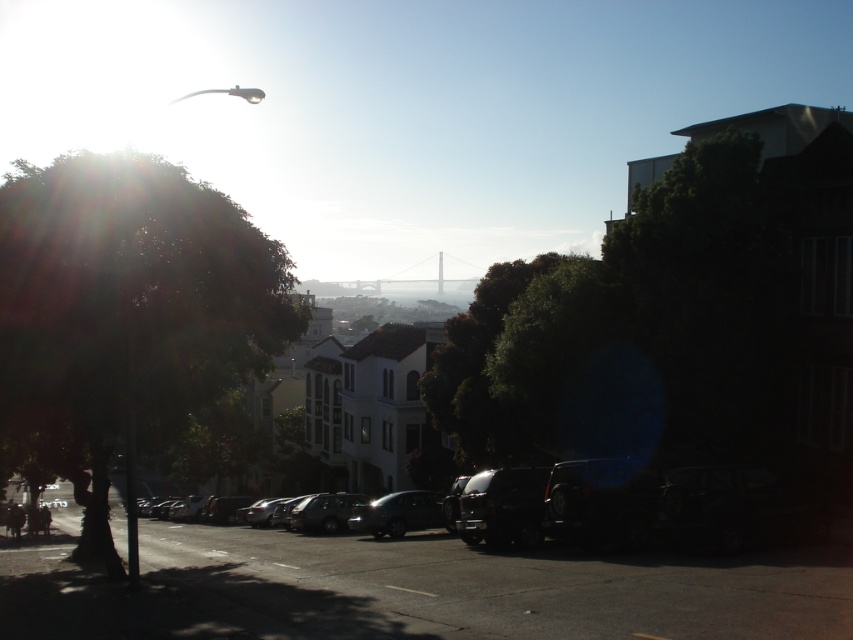
You are a pedestrian standing on the sidewalk near the green leafy tree at left. You want to cross the street to reach the shiny black car at center. Will the tree block your view of the car as you walk towards it?

The green leafy tree at left is in front of the shiny black car at center, so as you walk towards the car, the tree will block your view of it until you pass around the tree.

You are standing on the street in the scene and want to walk to both the point at coordinates (119,308) and the point at coordinates (418,506). Which point will you reach first?

You will reach the point at coordinates (119,308) first because it is closer to you than the point at coordinates (418,506).